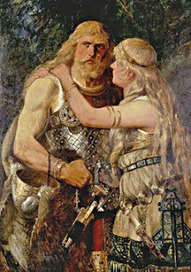
Where is `basket`? basket is located at coordinates (29, 178).